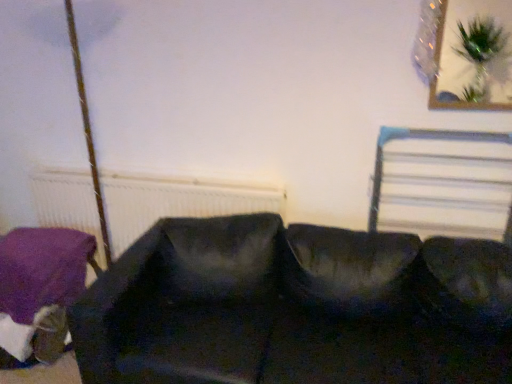
Locate an element on the screen. The width and height of the screenshot is (512, 384). purple fabric cushion at lower left is located at coordinates (42, 285).

Is black fabric couch at center inside or outside of purple fabric cushion at lower left?

black fabric couch at center is not inside purple fabric cushion at lower left, it's outside.

Is black fabric couch at center in front of or behind purple fabric cushion at lower left in the image?

black fabric couch at center is positioned closer to the viewer than purple fabric cushion at lower left.

Is black fabric couch at center to the left of purple fabric cushion at lower left from the viewer's perspective?

Incorrect, black fabric couch at center is not on the left side of purple fabric cushion at lower left.

Consider the image. From a real-world perspective, which is physically above, white textured radiator at left or purple fabric cushion at lower left?

From a 3D spatial view, white textured radiator at left is above.

Considering the relative positions of white textured radiator at left and purple fabric cushion at lower left in the image provided, is white textured radiator at left to the left of purple fabric cushion at lower left from the viewer's perspective?

In fact, white textured radiator at left is to the right of purple fabric cushion at lower left.

From the picture: Which of these two, white textured radiator at left or purple fabric cushion at lower left, is bigger?

With larger size is purple fabric cushion at lower left.

Between white textured radiator at left and purple fabric cushion at lower left, which one has less height?

With less height is purple fabric cushion at lower left.

Which object is positioned more to the left, purple fabric cushion at lower left or black fabric couch at center?

purple fabric cushion at lower left is more to the left.

How many degrees apart are the facing directions of purple fabric cushion at lower left and black fabric couch at center?

There is a 1.04-degree angle between the facing directions of purple fabric cushion at lower left and black fabric couch at center.

Is the position of purple fabric cushion at lower left less distant than that of black fabric couch at center?

No, purple fabric cushion at lower left is behind black fabric couch at center.

Is purple fabric cushion at lower left bigger or smaller than black fabric couch at center?

purple fabric cushion at lower left is smaller than black fabric couch at center.

From the image's perspective, is purple fabric cushion at lower left under white textured radiator at left?

Yes, from the image's perspective, purple fabric cushion at lower left is below white textured radiator at left.

Which point is more distant from viewer, (x=41, y=272) or (x=260, y=203)?

The point (x=260, y=203) is behind.

Consider the image. Which object is wider, purple fabric cushion at lower left or white textured radiator at left?

Wider between the two is purple fabric cushion at lower left.

Is purple fabric cushion at lower left positioned before white textured radiator at left?

Yes, purple fabric cushion at lower left is closer to the camera.

How far apart are purple fabric cushion at lower left and metallic silver bed frame at upper right?

The distance of purple fabric cushion at lower left from metallic silver bed frame at upper right is 5.20 feet.

The height and width of the screenshot is (384, 512). I want to click on bed frame above the purple fabric cushion at lower left (from a real-world perspective), so click(418, 138).

Which of these two, purple fabric cushion at lower left or metallic silver bed frame at upper right, stands shorter?

purple fabric cushion at lower left.

From the picture: Which is more to the left, purple fabric cushion at lower left or metallic silver bed frame at upper right?

purple fabric cushion at lower left.

In the image, is black fabric couch at center positioned in front of or behind white textured radiator at left?

In the image, black fabric couch at center appears in front of white textured radiator at left.

From the image's perspective, is black fabric couch at center beneath white textured radiator at left?

Yes, from the image's perspective, black fabric couch at center is below white textured radiator at left.

Visually, is black fabric couch at center positioned to the left or to the right of white textured radiator at left?

black fabric couch at center is positioned on white textured radiator at left's right side.

Considering the relative sizes of black fabric couch at center and white textured radiator at left in the image provided, is black fabric couch at center taller than white textured radiator at left?

Yes.

Considering their positions, is metallic silver bed frame at upper right located in front of or behind black fabric couch at center?

Clearly, metallic silver bed frame at upper right is behind black fabric couch at center.

Is point (381, 166) closer to viewer compared to point (305, 334)?

No, it is behind (305, 334).

Is black fabric couch at center at the back of metallic silver bed frame at upper right?

No, metallic silver bed frame at upper right's orientation is not away from black fabric couch at center.

Considering the relative sizes of metallic silver bed frame at upper right and black fabric couch at center in the image provided, is metallic silver bed frame at upper right shorter than black fabric couch at center?

Yes, metallic silver bed frame at upper right is shorter than black fabric couch at center.

Where is `furniture below the black fabric couch at center (from a real-world perspective)`? The image size is (512, 384). furniture below the black fabric couch at center (from a real-world perspective) is located at coordinates (42, 285).

I want to click on furniture below the white textured radiator at left (from the image's perspective), so click(x=42, y=285).

From the image, which object appears to be farther from metallic silver bed frame at upper right, white textured radiator at left or purple fabric cushion at lower left?

Among the two, purple fabric cushion at lower left is located further to metallic silver bed frame at upper right.

Based on their spatial positions, is black fabric couch at center or metallic silver bed frame at upper right closer to white textured radiator at left?

black fabric couch at center.

Which object lies nearer to the anchor point white textured radiator at left, metallic silver bed frame at upper right or purple fabric cushion at lower left?

purple fabric cushion at lower left is closer to white textured radiator at left.

Which object lies further to the anchor point black fabric couch at center, metallic silver bed frame at upper right or white textured radiator at left?

Among the two, metallic silver bed frame at upper right is located further to black fabric couch at center.

When comparing their distances from black fabric couch at center, does purple fabric cushion at lower left or metallic silver bed frame at upper right seem closer?

metallic silver bed frame at upper right is positioned closer to the anchor black fabric couch at center.

Which object lies further to the anchor point black fabric couch at center, metallic silver bed frame at upper right or purple fabric cushion at lower left?

The object further to black fabric couch at center is purple fabric cushion at lower left.

Which object lies further to the anchor point purple fabric cushion at lower left, white textured radiator at left or black fabric couch at center?

Among the two, black fabric couch at center is located further to purple fabric cushion at lower left.

From the image, which object appears to be farther from black fabric couch at center, white textured radiator at left or purple fabric cushion at lower left?

Based on the image, purple fabric cushion at lower left appears to be further to black fabric couch at center.

At what (x,y) coordinates should I click in order to perform the action: click on studio couch located between white textured radiator at left and metallic silver bed frame at upper right in the left-right direction. Please return your answer as a coordinate pair (x, y). Image resolution: width=512 pixels, height=384 pixels. Looking at the image, I should click on (296, 307).

Image resolution: width=512 pixels, height=384 pixels. Identify the location of radiator located between purple fabric cushion at lower left and metallic silver bed frame at upper right in the left-right direction. (176, 202).

You are a GUI agent. You are given a task and a screenshot of the screen. Output one action in this format:
    pyautogui.click(x=<x>, y=<y>)
    Task: Click on the radiator situated between purple fabric cushion at lower left and black fabric couch at center from left to right
    The width and height of the screenshot is (512, 384).
    Given the screenshot: What is the action you would take?
    pyautogui.click(x=176, y=202)

Find the location of `studio couch situated between purple fabric cushion at lower left and metallic silver bed frame at upper right from left to right`. studio couch situated between purple fabric cushion at lower left and metallic silver bed frame at upper right from left to right is located at coordinates (296, 307).